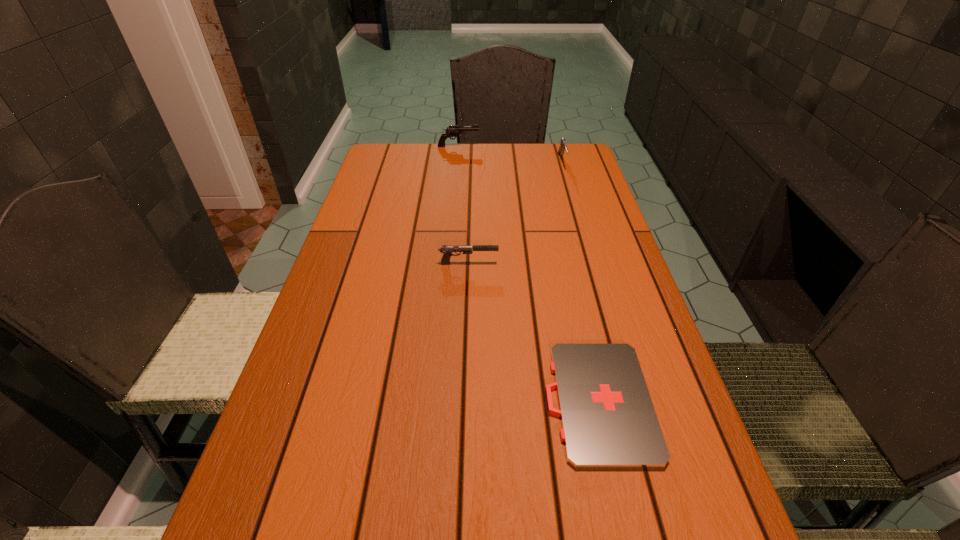
Identify the location of the third closest object to the shortest object. (452, 131).

Identify the location of object that is the third nearest to the rightmost gun. This screenshot has width=960, height=540. (608, 420).

Locate which gun ranks second in proximity to the first-aid kit. Please provide its 2D coordinates. Your answer should be formatted as a tuple, i.e. [(x, y)], where the tuple contains the x and y coordinates of a point satisfying the conditions above.

[(562, 142)]

Identify which gun is the second nearest to the farthest object. Please provide its 2D coordinates. Your answer should be formatted as a tuple, i.e. [(x, y)], where the tuple contains the x and y coordinates of a point satisfying the conditions above.

[(447, 250)]

Image resolution: width=960 pixels, height=540 pixels. I want to click on vacant space that satisfies the following two spatial constraints: 1. at the barrel of the second nearest gun; 2. on handle side the first-aid kit, so click(x=632, y=402).

Image resolution: width=960 pixels, height=540 pixels. I want to click on free space that satisfies the following two spatial constraints: 1. at the barrel of the third nearest object; 2. at the muzzle end of the shortest gun, so click(591, 263).

Image resolution: width=960 pixels, height=540 pixels. What are the coordinates of `vacant area that satisfies the following two spatial constraints: 1. at the barrel of the third nearest object; 2. at the muzzle end of the shortest gun` in the screenshot? It's located at (591, 263).

This screenshot has width=960, height=540. What are the coordinates of `blank space that satisfies the following two spatial constraints: 1. at the barrel of the rightmost gun; 2. at the muzzle end of the shortest gun` in the screenshot? It's located at (x=591, y=263).

Locate an element on the screen. vacant position in the image that satisfies the following two spatial constraints: 1. at the barrel of the rightmost gun; 2. at the muzzle end of the nearest gun is located at coordinates (591, 263).